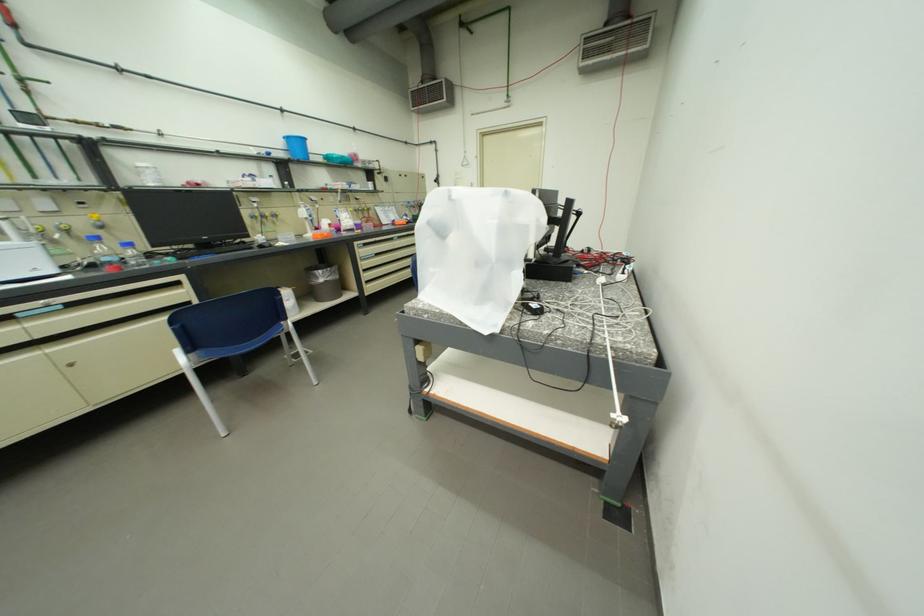
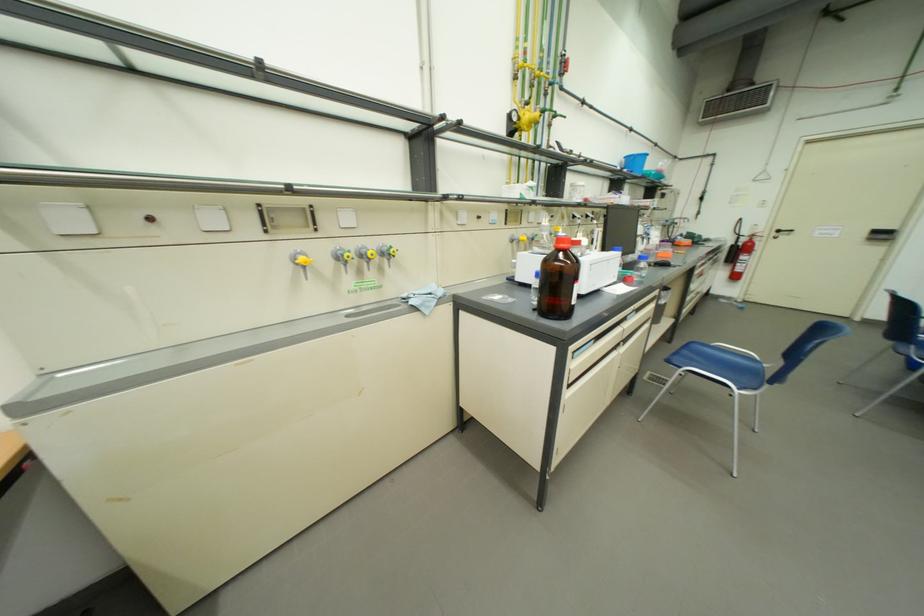
Find the pixel in the second image that matches (x=294, y=140) in the first image.

(634, 159)